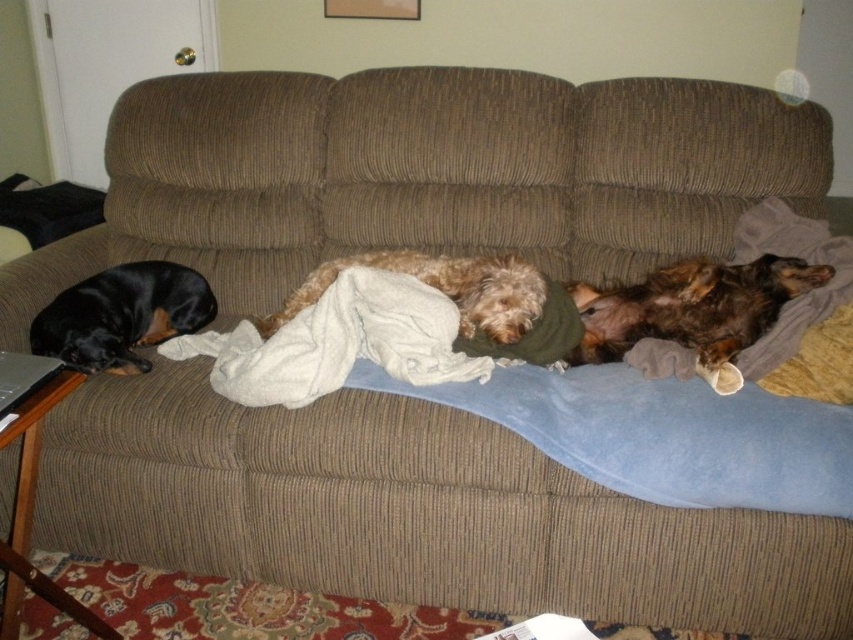
Question: Is brown shaggy dog at right to the right of fuzzy brown dog at center from the viewer's perspective?

Choices:
 (A) yes
 (B) no

Answer: (A)

Question: Which is farther from the brown shaggy dog at right?

Choices:
 (A) black smooth dog at left
 (B) fuzzy brown dog at center

Answer: (A)

Question: Which point appears closest to the camera in this image?

Choices:
 (A) (172, 284)
 (B) (436, 260)

Answer: (B)

Question: Is brown shaggy dog at right wider than fuzzy brown dog at center?

Choices:
 (A) no
 (B) yes

Answer: (A)

Question: Is brown shaggy dog at right positioned in front of fuzzy brown dog at center?

Choices:
 (A) no
 (B) yes

Answer: (A)

Question: Which point is closer to the camera?

Choices:
 (A) fuzzy brown dog at center
 (B) black smooth dog at left

Answer: (A)